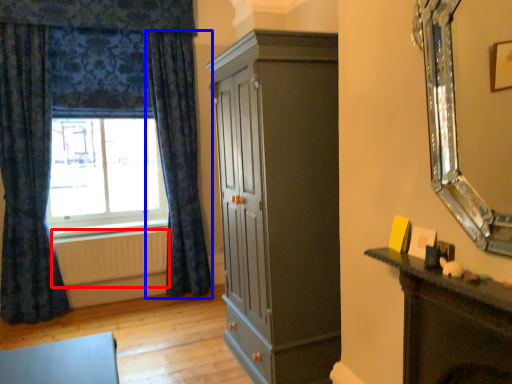
Question: Which point is closer to the camera, radiator (highlighted by a red box) or curtain (highlighted by a blue box)?

Choices:
 (A) radiator
 (B) curtain

Answer: (B)